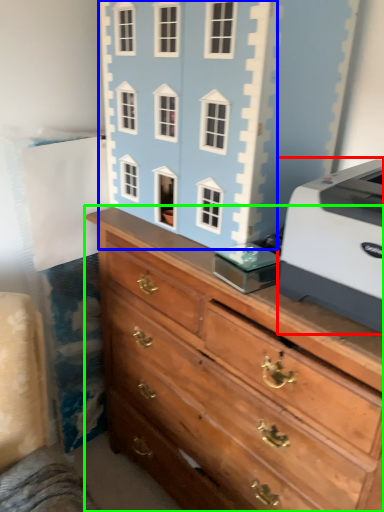
Question: Which object is positioned farthest from printer (highlighted by a red box)? Select from toy (highlighted by a blue box) and chest of drawers (highlighted by a green box).

Choices:
 (A) toy
 (B) chest of drawers

Answer: (A)